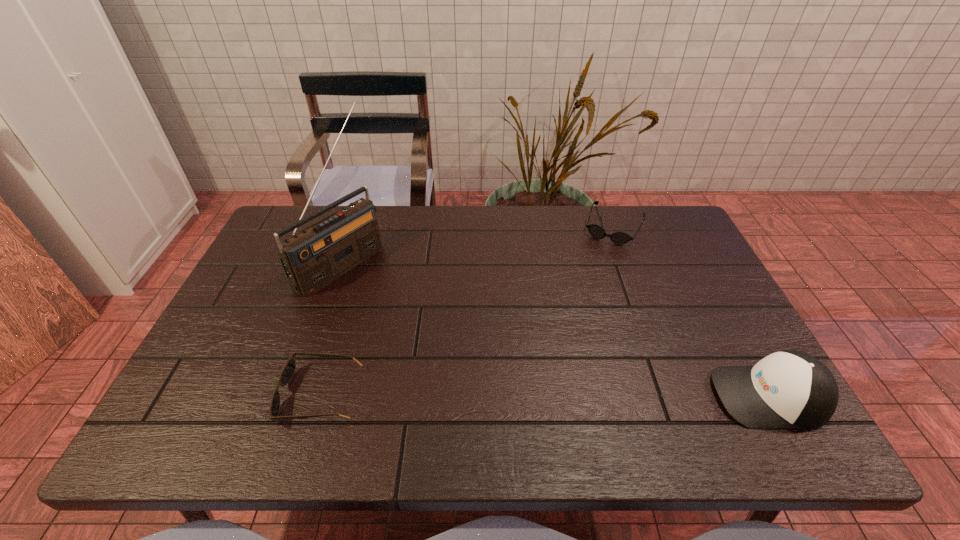
Where is `free space at the far left corner of the desktop`? This screenshot has width=960, height=540. free space at the far left corner of the desktop is located at coordinates (277, 228).

The height and width of the screenshot is (540, 960). In order to click on blank space at the far right corner of the desktop in this screenshot , I will do `click(647, 234)`.

The image size is (960, 540). I want to click on free spot between the left sunglasses and the cap, so pyautogui.click(x=544, y=396).

This screenshot has width=960, height=540. Identify the location of vacant area that lies between the farther sunglasses and the cap. (691, 312).

Find the location of a particular element. free spot between the right sunglasses and the tallest object is located at coordinates (477, 245).

In order to click on free space between the radio receiver and the second tallest object in this screenshot , I will do `click(555, 329)`.

At what (x,y) coordinates should I click in order to perform the action: click on vacant space that is in between the nearer sunglasses and the right sunglasses. Please return your answer as a coordinate pair (x, y). Looking at the image, I should click on (467, 311).

Find the location of a particular element. free space between the radio receiver and the left sunglasses is located at coordinates (331, 329).

This screenshot has width=960, height=540. I want to click on vacant area that lies between the farther sunglasses and the nearer sunglasses, so click(467, 311).

Locate an element on the screen. This screenshot has width=960, height=540. vacant space that is in between the second tallest object and the left sunglasses is located at coordinates pos(544,396).